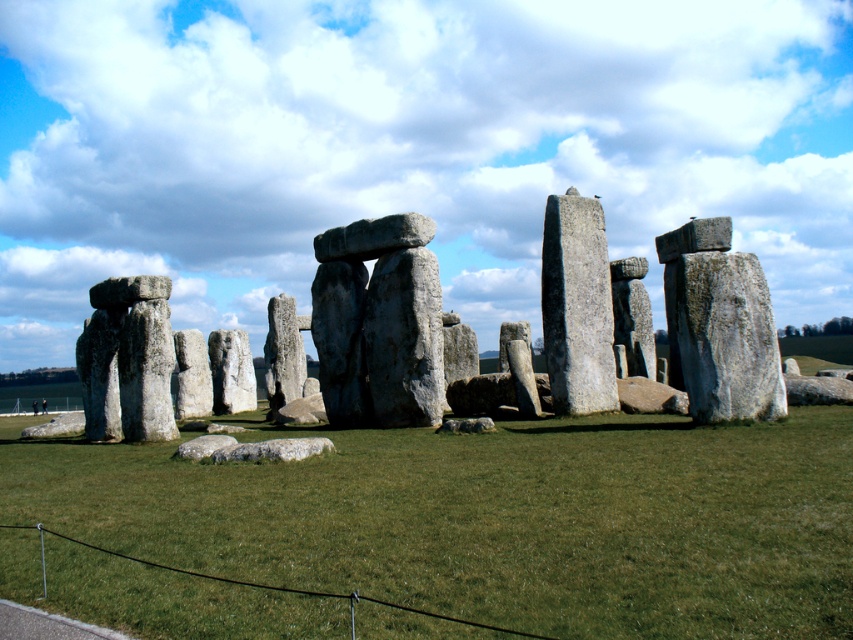
Can you confirm if green grass at center is thinner than gray stone monolith at center?

No.

Is green grass at center positioned at the back of gray stone monolith at center?

That is False.

The image size is (853, 640). Describe the element at coordinates (495, 518) in the screenshot. I see `green grass at center` at that location.

The image size is (853, 640). I want to click on green grass at center, so click(495, 518).

Does gray stone monolith at center appear on the left side of gray stone monolith at right?

Yes, gray stone monolith at center is to the left of gray stone monolith at right.

Which of these two, gray stone monolith at center or gray stone monolith at right, stands taller?

Standing taller between the two is gray stone monolith at center.

Who is more distant from viewer, (436, 339) or (709, 289)?

Point (436, 339)

Where is `gray stone monolith at center`? The width and height of the screenshot is (853, 640). gray stone monolith at center is located at coordinates (378, 323).

Consider the image. Which is more to the right, gray stone pillar at center or gray stone pillar at left?

Positioned to the right is gray stone pillar at center.

Which is more to the left, gray stone pillar at center or gray stone pillar at left?

From the viewer's perspective, gray stone pillar at left appears more on the left side.

Does point (575, 211) lie behind point (126, 419)?

That is True.

The width and height of the screenshot is (853, 640). Identify the location of gray stone pillar at center. (577, 305).